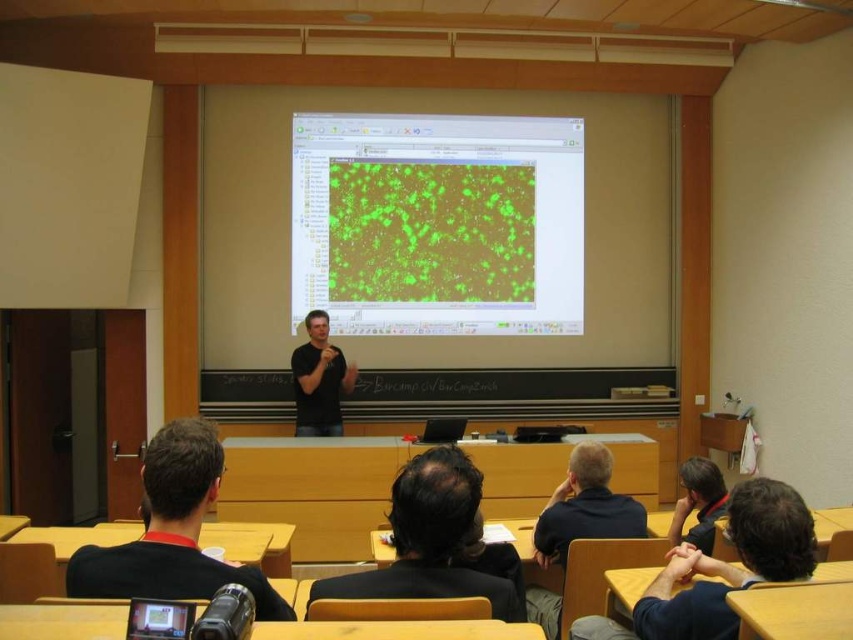
You are a student sitting in the classroom and want to determine which of the two points, point [221,452] or point [322,376], is closer to you. Based on the image, which point is nearer?

Point [221,452] is closer to the camera than point [322,376], so the student would perceive point [221,452] as nearer.

You are standing in the classroom facing the projection screen. There is a point labeled at coordinates (438, 224). What does this point correspond to on the screen?

The point at coordinates (438, 224) corresponds to the green matte image at center.